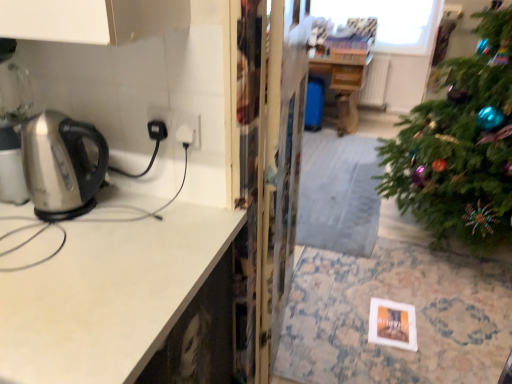
Describe the element at coordinates (108, 295) in the screenshot. I see `satin white countertop at left` at that location.

Describe the element at coordinates (142, 77) in the screenshot. The width and height of the screenshot is (512, 384). I see `metallic stainless steel kettle at left` at that location.

Image resolution: width=512 pixels, height=384 pixels. Describe the element at coordinates (266, 182) in the screenshot. I see `transparent plastic screen door at center` at that location.

Find the location of a particular element. Image resolution: width=512 pixels, height=384 pixels. satin white countertop at left is located at coordinates (108, 295).

Does point (239, 118) come farther from viewer compared to point (351, 99)?

No, it is not.

In terms of width, does transparent plastic screen door at center look wider or thinner when compared to wooden table at center?

In the image, transparent plastic screen door at center appears to be more narrow than wooden table at center.

Can you tell me how much transparent plastic screen door at center and wooden table at center differ in facing direction?

There is a 95.7-degree angle between the facing directions of transparent plastic screen door at center and wooden table at center.

Where is `table lying above the transparent plastic screen door at center (from the image's perspective)`? table lying above the transparent plastic screen door at center (from the image's perspective) is located at coordinates (343, 87).

Is transparent plastic screen door at center completely or partially inside wooden table at center?

No, wooden table at center does not contain transparent plastic screen door at center.

From the image's perspective, would you say wooden table at center is positioned over transparent plastic screen door at center?

Yes, from the image's perspective, wooden table at center is above transparent plastic screen door at center.

Is transparent plastic screen door at center at the back of wooden table at center?

No, transparent plastic screen door at center is not at the back of wooden table at center.

Between metallic stainless steel kettle at left and wooden table at center, which one has smaller width?

metallic stainless steel kettle at left is thinner.

Is metallic stainless steel kettle at left to the left of wooden table at center from the viewer's perspective?

Indeed, metallic stainless steel kettle at left is positioned on the left side of wooden table at center.

From a real-world perspective, between metallic stainless steel kettle at left and wooden table at center, who is vertically lower?

wooden table at center is physically lower.

Is point (86, 49) closer or farther from the camera than point (340, 111)?

Point (86, 49) is positioned closer to the camera compared to point (340, 111).

Who is shorter, satin white countertop at left or transparent plastic screen door at center?

With less height is satin white countertop at left.

Does satin white countertop at left touch transparent plastic screen door at center?

No, satin white countertop at left is not with transparent plastic screen door at center.

Is satin white countertop at left looking in the opposite direction of transparent plastic screen door at center?

Yes, transparent plastic screen door at center is at the back of satin white countertop at left.

Can you confirm if satin white countertop at left is positioned to the right of transparent plastic screen door at center?

Incorrect, satin white countertop at left is not on the right side of transparent plastic screen door at center.

Does metallic stainless steel kettle at left appear on the left side of satin white countertop at left?

In fact, metallic stainless steel kettle at left is to the right of satin white countertop at left.

How many degrees apart are the facing directions of metallic stainless steel kettle at left and satin white countertop at left?

metallic stainless steel kettle at left and satin white countertop at left are facing 0.0819 degrees away from each other.

Considering the sizes of objects metallic stainless steel kettle at left and satin white countertop at left in the image provided, who is shorter, metallic stainless steel kettle at left or satin white countertop at left?

satin white countertop at left is shorter.

From the image's perspective, who appears lower, metallic stainless steel kettle at left or satin white countertop at left?

From the image's view, metallic stainless steel kettle at left is below.

Does transparent plastic screen door at center have a greater height compared to satin white countertop at left?

Yes.

Considering the relative sizes of transparent plastic screen door at center and satin white countertop at left in the image provided, is transparent plastic screen door at center smaller than satin white countertop at left?

No.

From a real-world perspective, is transparent plastic screen door at center physically below satin white countertop at left?

Correct, in the physical world, transparent plastic screen door at center is lower than satin white countertop at left.

Based on the photo, is transparent plastic screen door at center located outside satin white countertop at left?

Yes.

Is point (335, 59) positioned before point (123, 117)?

No.

Considering the positions of objects wooden table at center and metallic stainless steel kettle at left in the image provided, who is in front, wooden table at center or metallic stainless steel kettle at left?

metallic stainless steel kettle at left.

Does wooden table at center appear on the right side of metallic stainless steel kettle at left?

Indeed, wooden table at center is positioned on the right side of metallic stainless steel kettle at left.

Where is `table located behind the transparent plastic screen door at center`? This screenshot has width=512, height=384. table located behind the transparent plastic screen door at center is located at coordinates (343, 87).

I want to click on table located underneath the transparent plastic screen door at center (from a real-world perspective), so click(343, 87).

Considering their positions, is metallic stainless steel kettle at left positioned closer to transparent plastic screen door at center than satin white countertop at left?

Based on the image, metallic stainless steel kettle at left appears to be nearer to transparent plastic screen door at center.

Looking at the image, which one is located closer to metallic stainless steel kettle at left, satin white countertop at left or transparent plastic screen door at center?

satin white countertop at left lies closer to metallic stainless steel kettle at left than the other object.

When comparing their distances from transparent plastic screen door at center, does satin white countertop at left or wooden table at center seem further?

Based on the image, wooden table at center appears to be further to transparent plastic screen door at center.

From the image, which object appears to be farther from satin white countertop at left, wooden table at center or transparent plastic screen door at center?

wooden table at center.

Estimate the real-world distances between objects in this image. Which object is further from wooden table at center, transparent plastic screen door at center or metallic stainless steel kettle at left?

metallic stainless steel kettle at left.

Based on their spatial positions, is transparent plastic screen door at center or wooden table at center closer to satin white countertop at left?

Based on the image, transparent plastic screen door at center appears to be nearer to satin white countertop at left.

Considering their positions, is metallic stainless steel kettle at left positioned further to transparent plastic screen door at center than wooden table at center?

Among the two, wooden table at center is located further to transparent plastic screen door at center.

When comparing their distances from metallic stainless steel kettle at left, does transparent plastic screen door at center or wooden table at center seem further?

The object further to metallic stainless steel kettle at left is wooden table at center.

Find the location of a particular element. The image size is (512, 384). screen door positioned between metallic stainless steel kettle at left and wooden table at center from near to far is located at coordinates (266, 182).

Where is `cabinetry between satin white countertop at left and transparent plastic screen door at center`? Image resolution: width=512 pixels, height=384 pixels. cabinetry between satin white countertop at left and transparent plastic screen door at center is located at coordinates (142, 77).

You are a GUI agent. You are given a task and a screenshot of the screen. Output one action in this format:
    pyautogui.click(x=<x>, y=<y>)
    Task: Click on the screen door located between satin white countertop at left and wooden table at center in the depth direction
    
    Given the screenshot: What is the action you would take?
    pyautogui.click(x=266, y=182)

Locate an element on the screen. The width and height of the screenshot is (512, 384). cabinetry between satin white countertop at left and wooden table at center along the z-axis is located at coordinates (142, 77).